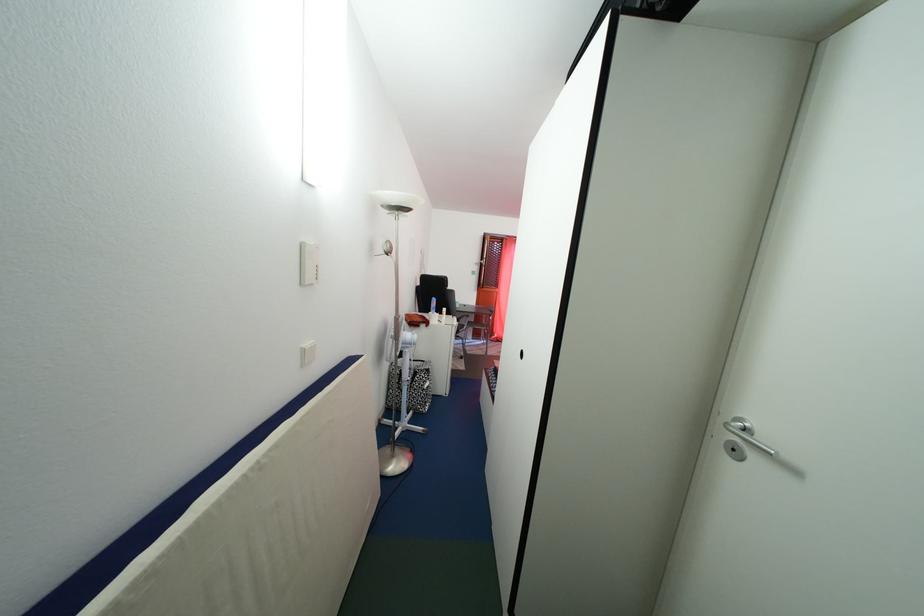
Where would you sit the chair sitting surface? Please return your answer as a coordinate pair (x, y).

(470, 325)